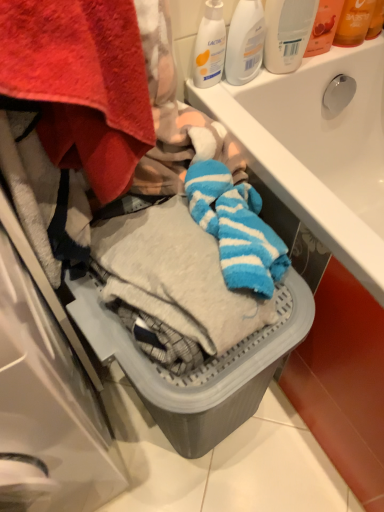
Measure the distance between white glossy sink at upper center and camera.

white glossy sink at upper center and camera are 21.38 inches apart.

What do you see at coordinates (210, 46) in the screenshot? The image size is (384, 512). I see `white matte lotion at upper right, placed as the 3th cleaning product when sorted from right to left` at bounding box center [210, 46].

In order to click on white plastic bottle at upper right, marked as the 1th cleaning product in a right-to-left arrangement in this screenshot , I will do coord(287,33).

Is white matte lotion at upper right, the 1th cleaning product viewed from the left, facing towards white glossy sink at upper center?

No, white matte lotion at upper right, the 1th cleaning product viewed from the left, is not facing towards white glossy sink at upper center.

Does white matte lotion at upper right, placed as the 3th cleaning product when sorted from right to left, have a smaller size compared to white glossy sink at upper center?

Correct, white matte lotion at upper right, placed as the 3th cleaning product when sorted from right to left, occupies less space than white glossy sink at upper center.

Image resolution: width=384 pixels, height=512 pixels. In order to click on cleaning product that is the 1st object above the white glossy sink at upper center (from a real-world perspective) in this screenshot , I will do `click(210, 46)`.

Does gray plastic basket at lower center turn towards white glossy sink at upper center?

No, gray plastic basket at lower center does not turn towards white glossy sink at upper center.

At what (x,y) coordinates should I click in order to perform the action: click on sink located above the gray plastic basket at lower center (from the image's perspective). Please return your answer as a coordinate pair (x, y). Image resolution: width=384 pixels, height=512 pixels. Looking at the image, I should click on (317, 149).

Looking at this image, can you tell me how much gray plastic basket at lower center and white glossy sink at upper center differ in facing direction?

The facing directions of gray plastic basket at lower center and white glossy sink at upper center are 97.2 degrees apart.

From a real-world perspective, is translucent plastic bottle at upper right, the 1th toiletry from the left, on white matte lotion at upper right, placed as the 3th cleaning product when sorted from right to left?

Indeed, from a real-world perspective, translucent plastic bottle at upper right, the 1th toiletry from the left, stands above white matte lotion at upper right, placed as the 3th cleaning product when sorted from right to left.

Considering the positions of objects translucent plastic bottle at upper right, the 2th toiletry in the right-to-left sequence, and white matte lotion at upper right, the 1th cleaning product viewed from the left, in the image provided, who is behind, translucent plastic bottle at upper right, the 2th toiletry in the right-to-left sequence, or white matte lotion at upper right, the 1th cleaning product viewed from the left,?

Positioned behind is translucent plastic bottle at upper right, the 2th toiletry in the right-to-left sequence.

Is translucent plastic bottle at upper right, the 1th toiletry from the left, thinner than white matte lotion at upper right, the 1th cleaning product viewed from the left?

In fact, translucent plastic bottle at upper right, the 1th toiletry from the left, might be wider than white matte lotion at upper right, the 1th cleaning product viewed from the left.

Would you say translucent plastic bottle at upper right, the 1th toiletry from the left, contains gray plastic basket at lower center?

No, gray plastic basket at lower center is not inside translucent plastic bottle at upper right, the 1th toiletry from the left.

From a real-world perspective, between translucent plastic bottle at upper right, the 1th toiletry from the left, and gray plastic basket at lower center, who is vertically higher?

translucent plastic bottle at upper right, the 1th toiletry from the left, is physically above.

Does point (316, 20) come farther from viewer compared to point (183, 399)?

Yes, it is.

Could you tell me if translucent plastic bottle at upper right, the 1th toiletry from the left, is facing gray plastic basket at lower center?

No, translucent plastic bottle at upper right, the 1th toiletry from the left, is not aimed at gray plastic basket at lower center.

Is white plastic bottle at upper right, placed as the third cleaning product when sorted from left to right, spatially inside gray plastic basket at lower center, or outside of it?

white plastic bottle at upper right, placed as the third cleaning product when sorted from left to right, is spatially situated outside gray plastic basket at lower center.

Which is nearer, (305,16) or (156,397)?

Positioned in front is point (156,397).

Who is bigger, white plastic bottle at upper right, marked as the 1th cleaning product in a right-to-left arrangement, or gray plastic basket at lower center?

Bigger between the two is gray plastic basket at lower center.

Consider the image. Is white plastic bottle at upper right, marked as the 1th cleaning product in a right-to-left arrangement, oriented towards gray plastic basket at lower center?

No, white plastic bottle at upper right, marked as the 1th cleaning product in a right-to-left arrangement, is not turned towards gray plastic basket at lower center.

Who is smaller, white glossy sink at upper center or white plastic bottle at upper right, placed as the third cleaning product when sorted from left to right?

white plastic bottle at upper right, placed as the third cleaning product when sorted from left to right.

Is white glossy sink at upper center closer to camera compared to white plastic bottle at upper right, placed as the third cleaning product when sorted from left to right?

Yes, it is.

Is white glossy sink at upper center taller than white plastic bottle at upper right, placed as the third cleaning product when sorted from left to right?

Yes.

Considering the positions of objects white glossy sink at upper center and white plastic bottle at upper right, marked as the 1th cleaning product in a right-to-left arrangement, in the image provided, who is more to the right, white glossy sink at upper center or white plastic bottle at upper right, marked as the 1th cleaning product in a right-to-left arrangement,?

From the viewer's perspective, white glossy sink at upper center appears more on the right side.

Which is more to the right, gray plastic basket at lower center or white matte lotion at upper right, the 1th cleaning product viewed from the left?

white matte lotion at upper right, the 1th cleaning product viewed from the left, is more to the right.

From a real-world perspective, is gray plastic basket at lower center above or below white matte lotion at upper right, the 1th cleaning product viewed from the left?

Clearly, from a real-world perspective, gray plastic basket at lower center is below white matte lotion at upper right, the 1th cleaning product viewed from the left.

Which object is closer to the camera taking this photo, gray plastic basket at lower center or white matte lotion at upper right, placed as the 3th cleaning product when sorted from right to left?

gray plastic basket at lower center.

Which of these two, gray plastic basket at lower center or white matte lotion at upper right, the 1th cleaning product viewed from the left, stands taller?

Standing taller between the two is gray plastic basket at lower center.

At what (x,y) coordinates should I click in order to perform the action: click on sink below the white matte lotion at upper right, placed as the 3th cleaning product when sorted from right to left (from a real-world perspective). Please return your answer as a coordinate pair (x, y). Looking at the image, I should click on (317, 149).

This screenshot has height=512, width=384. Find the location of `dish washer that is below the white glossy sink at upper center (from the image's perspective)`. dish washer that is below the white glossy sink at upper center (from the image's perspective) is located at coordinates (198, 367).

When comparing their distances from gray plastic basket at lower center, does translucent plastic bottle at upper right, the 1th toiletry from the left, or white plastic bottle at upper right, marked as the 1th cleaning product in a right-to-left arrangement, seem closer?

white plastic bottle at upper right, marked as the 1th cleaning product in a right-to-left arrangement, lies closer to gray plastic basket at lower center than the other object.

Looking at the image, which one is located further to translucent plastic bottle at upper right, the 1th toiletry from the left, white glossy sink at upper center or gray plastic basket at lower center?

Among the two, gray plastic basket at lower center is located further to translucent plastic bottle at upper right, the 1th toiletry from the left.

From the image, which object appears to be nearer to translucent orange lotion at upper right, the 2th toiletry in the left-to-right sequence, translucent plastic bottle at upper right, the 1th toiletry from the left, or white plastic bottle at upper right, marked as the 1th cleaning product in a right-to-left arrangement?

Among the two, translucent plastic bottle at upper right, the 1th toiletry from the left, is located nearer to translucent orange lotion at upper right, the 2th toiletry in the left-to-right sequence.

Estimate the real-world distances between objects in this image. Which object is closer to white glossy sink at upper center, white plastic bottle at upper center, the second cleaning product positioned from the left, or white matte lotion at upper right, placed as the 3th cleaning product when sorted from right to left?

Among the two, white plastic bottle at upper center, the second cleaning product positioned from the left, is located nearer to white glossy sink at upper center.

Which object lies further to the anchor point white glossy sink at upper center, translucent orange lotion at upper right, which is the 1th toiletry in right-to-left order, or translucent plastic bottle at upper right, the 2th toiletry in the right-to-left sequence?

Based on the image, translucent orange lotion at upper right, which is the 1th toiletry in right-to-left order, appears to be further to white glossy sink at upper center.

When comparing their distances from gray plastic basket at lower center, does white plastic bottle at upper center, which is the 2th cleaning product in right-to-left order, or translucent orange lotion at upper right, the 2th toiletry in the left-to-right sequence, seem further?

translucent orange lotion at upper right, the 2th toiletry in the left-to-right sequence, lies further to gray plastic basket at lower center than the other object.

Based on their spatial positions, is translucent plastic bottle at upper right, the 2th toiletry in the right-to-left sequence, or white glossy sink at upper center closer to white plastic bottle at upper right, placed as the third cleaning product when sorted from left to right?

translucent plastic bottle at upper right, the 2th toiletry in the right-to-left sequence, lies closer to white plastic bottle at upper right, placed as the third cleaning product when sorted from left to right, than the other object.

Which object lies nearer to the anchor point white plastic bottle at upper right, placed as the third cleaning product when sorted from left to right, translucent plastic bottle at upper right, the 2th toiletry in the right-to-left sequence, or translucent orange lotion at upper right, the 2th toiletry in the left-to-right sequence?

Based on the image, translucent plastic bottle at upper right, the 2th toiletry in the right-to-left sequence, appears to be nearer to white plastic bottle at upper right, placed as the third cleaning product when sorted from left to right.

Where is `cleaning product between white plastic bottle at upper center, which is the 2th cleaning product in right-to-left order, and translucent orange lotion at upper right, the 2th toiletry in the left-to-right sequence, in the horizontal direction`? The height and width of the screenshot is (512, 384). cleaning product between white plastic bottle at upper center, which is the 2th cleaning product in right-to-left order, and translucent orange lotion at upper right, the 2th toiletry in the left-to-right sequence, in the horizontal direction is located at coordinates (287, 33).

The height and width of the screenshot is (512, 384). Find the location of `sink between white matte lotion at upper right, the 1th cleaning product viewed from the left, and gray plastic basket at lower center vertically`. sink between white matte lotion at upper right, the 1th cleaning product viewed from the left, and gray plastic basket at lower center vertically is located at coordinates pos(317,149).

Find the location of a particular element. This screenshot has height=512, width=384. toiletry between white matte lotion at upper right, placed as the 3th cleaning product when sorted from right to left, and translucent orange lotion at upper right, the 2th toiletry in the left-to-right sequence is located at coordinates (324, 27).

Locate an element on the screen. sink between white plastic bottle at upper right, marked as the 1th cleaning product in a right-to-left arrangement, and gray plastic basket at lower center from top to bottom is located at coordinates (317, 149).